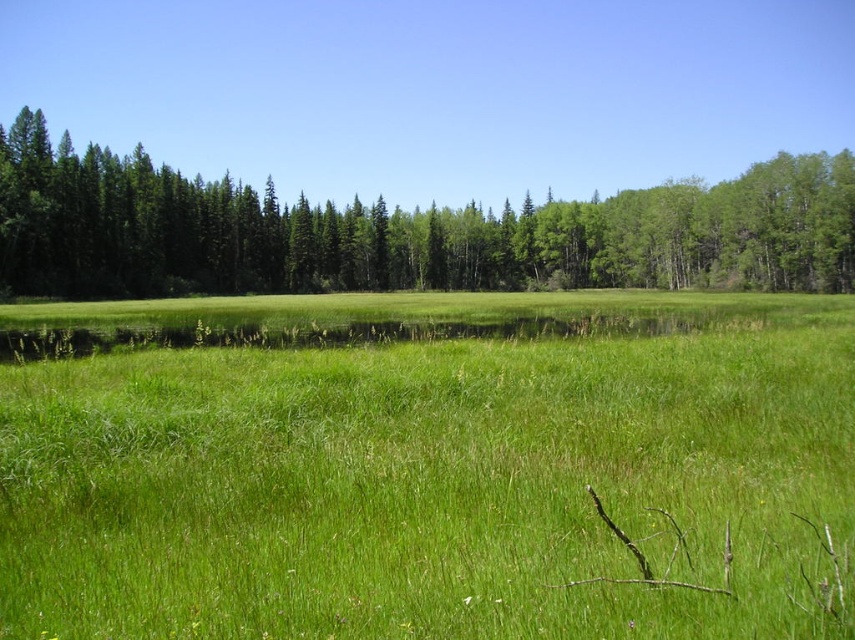
Does green grassy field at center have a greater height compared to green matte trees at center?

In fact, green grassy field at center may be shorter than green matte trees at center.

Does green grassy field at center appear over green matte trees at center?

No, green grassy field at center is not above green matte trees at center.

Which is behind, point (740, 324) or point (127, 257)?

Positioned behind is point (127, 257).

Identify the location of green grassy field at center. (423, 465).